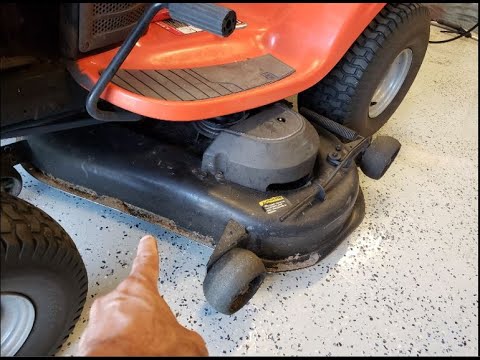
Where is `floor`? The image size is (480, 360). floor is located at coordinates (382, 273).